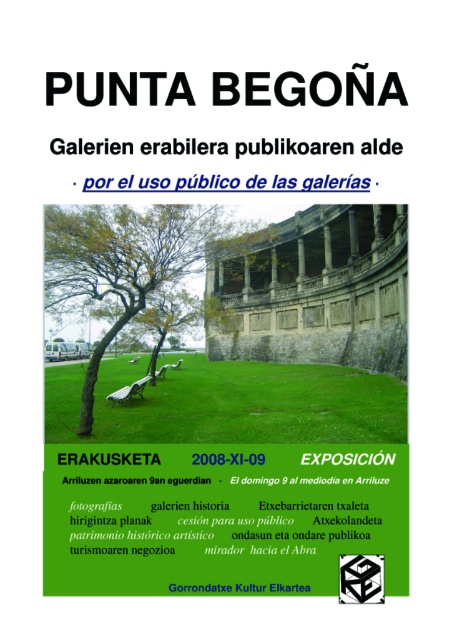
Question: Is green grass at center further to the viewer compared to green leafy tree at center?

Choices:
 (A) no
 (B) yes

Answer: (A)

Question: Considering the relative positions of green grass at center and green leafy tree at center in the image provided, where is green grass at center located with respect to green leafy tree at center?

Choices:
 (A) left
 (B) right

Answer: (B)

Question: Does green grass at center have a greater width compared to green leafy tree at center?

Choices:
 (A) yes
 (B) no

Answer: (A)

Question: Which point is farther to the camera?

Choices:
 (A) (267, 365)
 (B) (75, 252)

Answer: (A)

Question: Which point is closer to the camera?

Choices:
 (A) green grass at center
 (B) green leafy tree at center

Answer: (A)